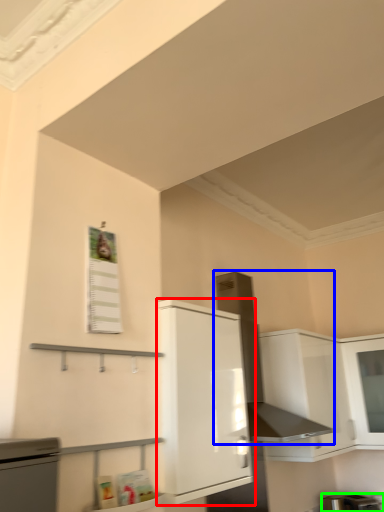
Question: Which object is positioned farthest from cabinetry (highlighted by a red box)? Select from exhaust hood (highlighted by a blue box) and appliance (highlighted by a green box).

Choices:
 (A) exhaust hood
 (B) appliance

Answer: (B)